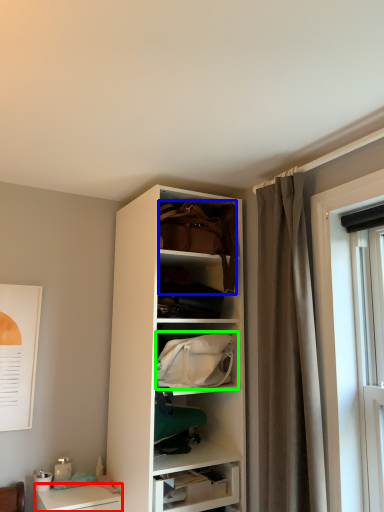
Question: Estimate the real-world distances between objects in this image. Which object is closer to desk (highlighted by a red box), handbag (highlighted by a blue box) or handbag (highlighted by a green box)?

Choices:
 (A) handbag
 (B) handbag

Answer: (B)